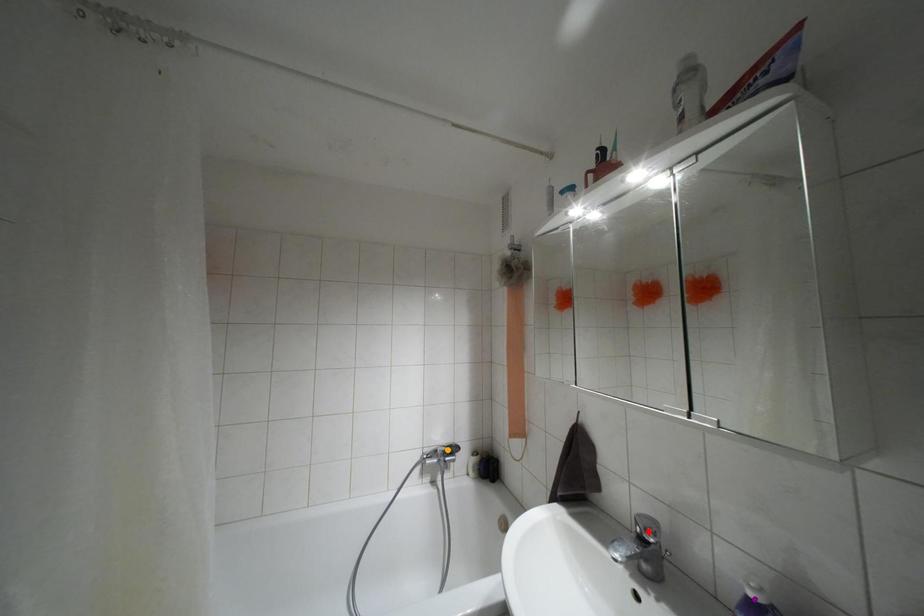
Order these from nearest to farthest:
- red point
- purple point
- orange point

orange point
red point
purple point